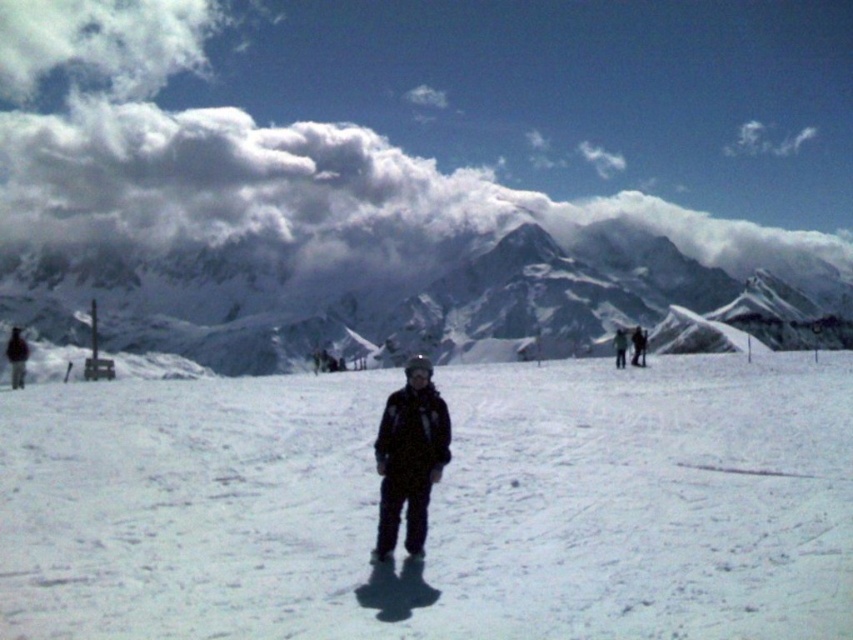
Question: Is the position of white fluffy cloud at upper center more distant than that of dark gray ski suit at center?

Choices:
 (A) yes
 (B) no

Answer: (A)

Question: Among these points, which one is nearest to the camera?

Choices:
 (A) (41, 208)
 (B) (426, 406)
 (C) (334, 525)

Answer: (C)

Question: Does white snow at center come behind white fluffy cloud at upper center?

Choices:
 (A) no
 (B) yes

Answer: (A)

Question: Which object is positioned farthest from the dark gray ski suit at center?

Choices:
 (A) white snow-covered mountain at upper center
 (B) white snow at center

Answer: (A)

Question: Does white snow at center have a larger size compared to dark gray ski suit at center?

Choices:
 (A) no
 (B) yes

Answer: (B)

Question: Based on their relative distances, which object is farther from the white fluffy cloud at upper center?

Choices:
 (A) dark gray ski suit at center
 (B) white snow-covered mountain at upper center
 (C) white snow at center

Answer: (A)